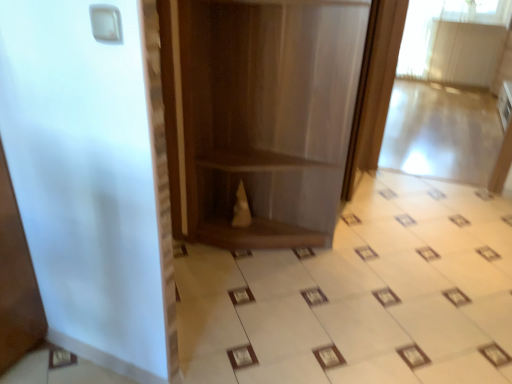
Question: From a real-world perspective, is matte brown bookshelf at center above or below white glossy ceramic tile at center?

Choices:
 (A) above
 (B) below

Answer: (A)

Question: Is point (215, 94) closer or farther from the camera than point (488, 334)?

Choices:
 (A) farther
 (B) closer

Answer: (A)

Question: In the image, is matte brown bookshelf at center positioned in front of or behind white glossy ceramic tile at center?

Choices:
 (A) front
 (B) behind

Answer: (B)

Question: In terms of height, does white glossy ceramic tile at center look taller or shorter compared to matte brown bookshelf at center?

Choices:
 (A) short
 (B) tall

Answer: (A)

Question: Considering the positions of white glossy ceramic tile at center and matte brown bookshelf at center in the image, is white glossy ceramic tile at center bigger or smaller than matte brown bookshelf at center?

Choices:
 (A) small
 (B) big

Answer: (A)

Question: From a real-world perspective, relative to matte brown bookshelf at center, is white glossy ceramic tile at center vertically above or below?

Choices:
 (A) above
 (B) below

Answer: (B)

Question: Does point (420, 311) appear closer or farther from the camera than point (245, 48)?

Choices:
 (A) closer
 (B) farther

Answer: (A)